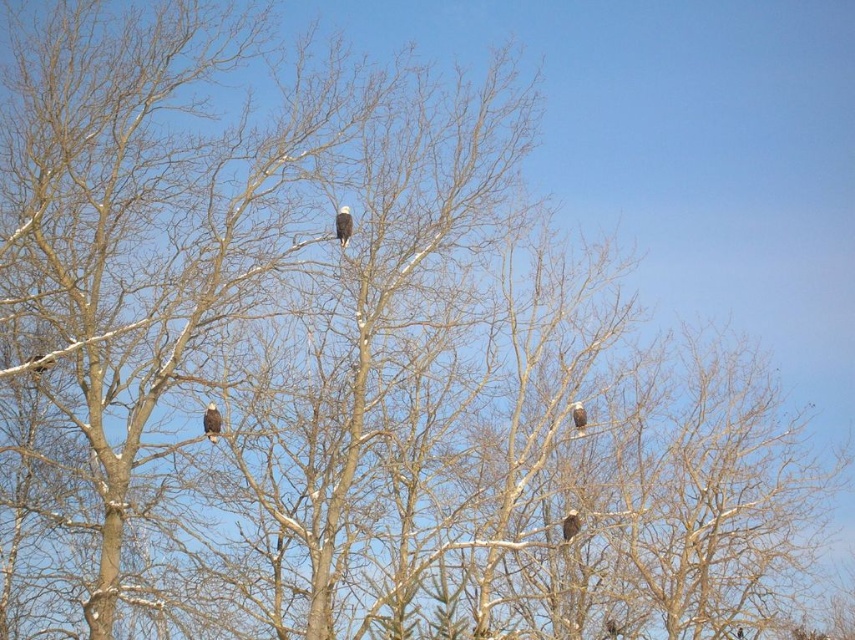
Question: Which point is farther to the camera?

Choices:
 (A) (581, 419)
 (B) (348, 220)
 (C) (220, 426)

Answer: (A)

Question: Does white feathered eagle at center have a larger size compared to white feathered crow at upper center?

Choices:
 (A) yes
 (B) no

Answer: (A)

Question: Which of the following is the closest to the observer?

Choices:
 (A) white feathered crow at upper center
 (B) white feathered eagle at center

Answer: (B)

Question: Does white feathered eagle at upper center have a smaller size compared to white feathered crow at upper center?

Choices:
 (A) yes
 (B) no

Answer: (B)

Question: Can you confirm if white feathered eagle at center is bigger than white feathered crow at upper center?

Choices:
 (A) no
 (B) yes

Answer: (B)

Question: Which of the following is the farthest from the observer?

Choices:
 (A) white feathered eagle at upper center
 (B) white feathered eagle at center
 (C) white feathered crow at upper center

Answer: (C)